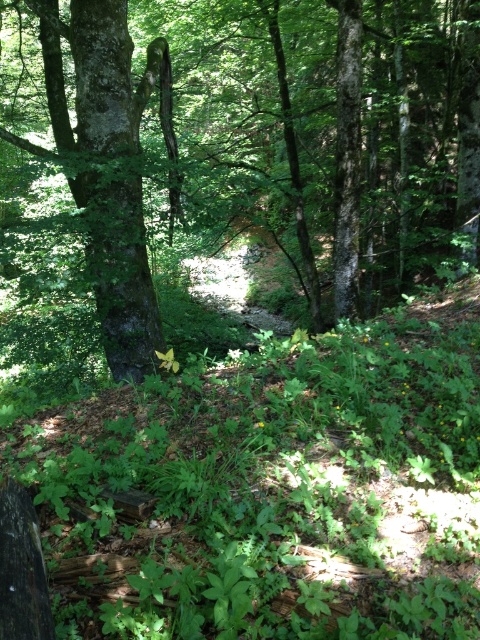
Question: Is green rough bark tree at center above smooth bark tree at center?

Choices:
 (A) no
 (B) yes

Answer: (B)

Question: Which point is farther to the camera?

Choices:
 (A) (44, 148)
 (B) (14, 6)

Answer: (B)

Question: Which of the following is the closest to the observer?

Choices:
 (A) green rough bark tree at center
 (B) smooth bark tree at center

Answer: (A)

Question: Can you confirm if green rough bark tree at center is thinner than smooth bark tree at center?

Choices:
 (A) yes
 (B) no

Answer: (B)

Question: Is green rough bark tree at center wider than smooth bark tree at center?

Choices:
 (A) no
 (B) yes

Answer: (B)